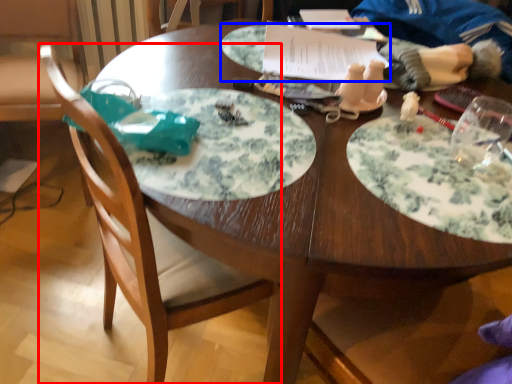
Question: Which object is closer to the camera taking this photo, chair (highlighted by a red box) or platter (highlighted by a blue box)?

Choices:
 (A) chair
 (B) platter

Answer: (A)